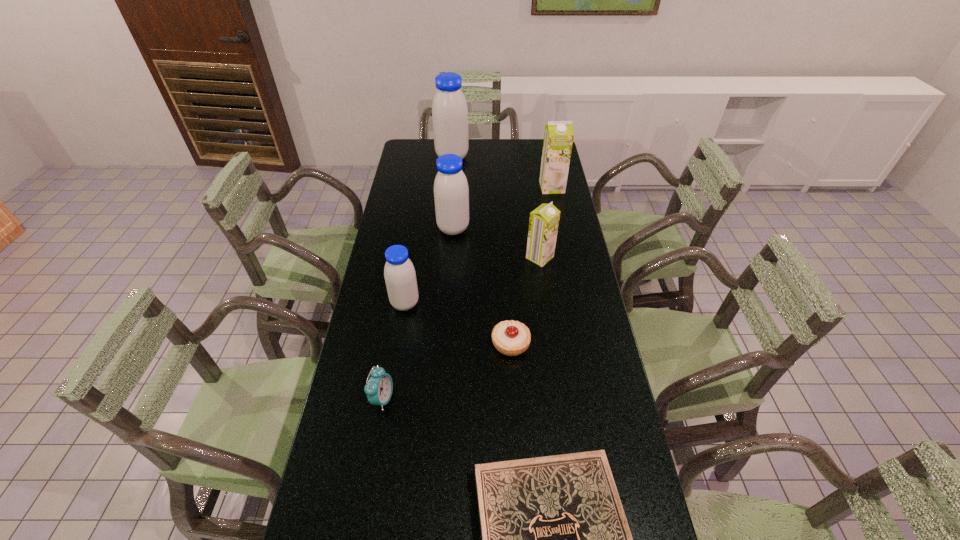
This screenshot has width=960, height=540. Find the location of `the second nearest object`. the second nearest object is located at coordinates (379, 388).

Find the location of `the third shortest object`. the third shortest object is located at coordinates (379, 388).

Identify the location of pastry. coord(511,338).

Locate an element on the screen. beige pastry is located at coordinates (511, 338).

Image resolution: width=960 pixels, height=540 pixels. Find the location of `vacant space located 0.180m on the right of the farthest object`. vacant space located 0.180m on the right of the farthest object is located at coordinates (507, 158).

Identify the location of free space located 0.390m on the left of the seventh nearest object. (449, 187).

At what (x,y) coordinates should I click in order to perform the action: click on vacant space located on the front of the sixth nearest object. Please return your answer as a coordinate pair (x, y). Looking at the image, I should click on (448, 308).

The width and height of the screenshot is (960, 540). Find the location of `vacant space located 0.270m on the back of the smaller green soya milk`. vacant space located 0.270m on the back of the smaller green soya milk is located at coordinates (533, 205).

Locate an element on the screen. free space located on the right of the fourth nearest object is located at coordinates (497, 303).

Locate an element on the screen. The image size is (960, 540). free spot located on the face of the third shortest object is located at coordinates (519, 399).